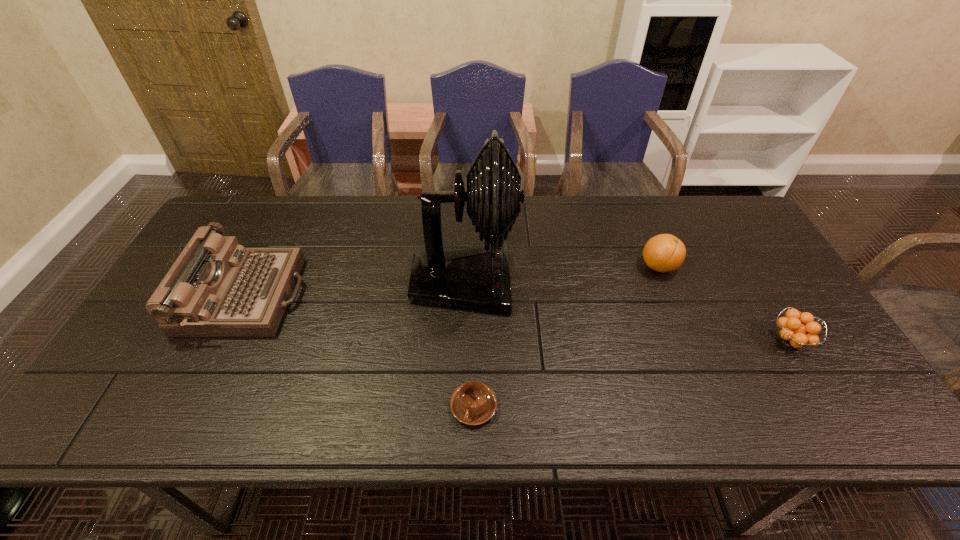
Find the location of `vacant space located on the keyboard of the leftmost object`. vacant space located on the keyboard of the leftmost object is located at coordinates click(334, 296).

In order to click on vacant area located 0.120m on the back of the taller orange fruit in this screenshot , I will do pyautogui.click(x=643, y=228).

The height and width of the screenshot is (540, 960). I want to click on free location located 0.200m on the back of the right orange fruit, so click(x=748, y=269).

Where is `object that is at the near edge`? The height and width of the screenshot is (540, 960). object that is at the near edge is located at coordinates (473, 403).

You are a GUI agent. You are given a task and a screenshot of the screen. Output one action in this format:
    pyautogui.click(x=<x>, y=<y>)
    Task: Click on the object located in the left edge section of the desktop
    
    Given the screenshot: What is the action you would take?
    pyautogui.click(x=216, y=288)

This screenshot has height=540, width=960. Find the location of `object at the right edge`. object at the right edge is located at coordinates (793, 333).

This screenshot has height=540, width=960. In order to click on vacant space at the far edge of the desktop in this screenshot , I will do `click(462, 234)`.

You are a GUI agent. You are given a task and a screenshot of the screen. Output one action in this format:
    pyautogui.click(x=<x>, y=<y>)
    Task: Click on the free location at the near edge of the desktop
    The image size is (960, 540).
    Given the screenshot: What is the action you would take?
    pyautogui.click(x=296, y=416)

Where is `vacant space at the left edge of the desktop`? vacant space at the left edge of the desktop is located at coordinates (125, 382).

Identify the location of vacant space at the right edge of the desktop. (720, 252).